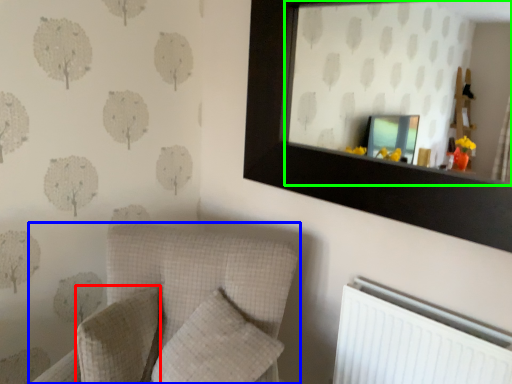
Question: Which object is positioned closest to pillow (highlighted by a red box)? Select from furniture (highlighted by a blue box) and mirror (highlighted by a green box).

Choices:
 (A) furniture
 (B) mirror

Answer: (A)